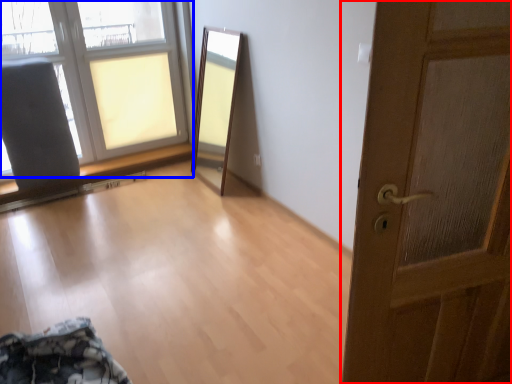
Question: Which of the following is the farthest to the observer, door (highlighted by a red box) or window (highlighted by a blue box)?

Choices:
 (A) door
 (B) window

Answer: (B)